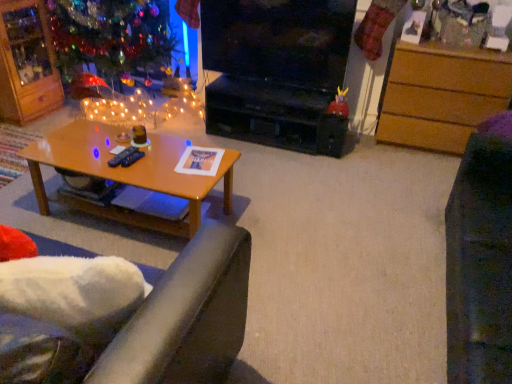
What are the coordinates of `free space in front of black plastic remote control at center, the 2th remote control viewed from the left` in the screenshot? It's located at (128, 168).